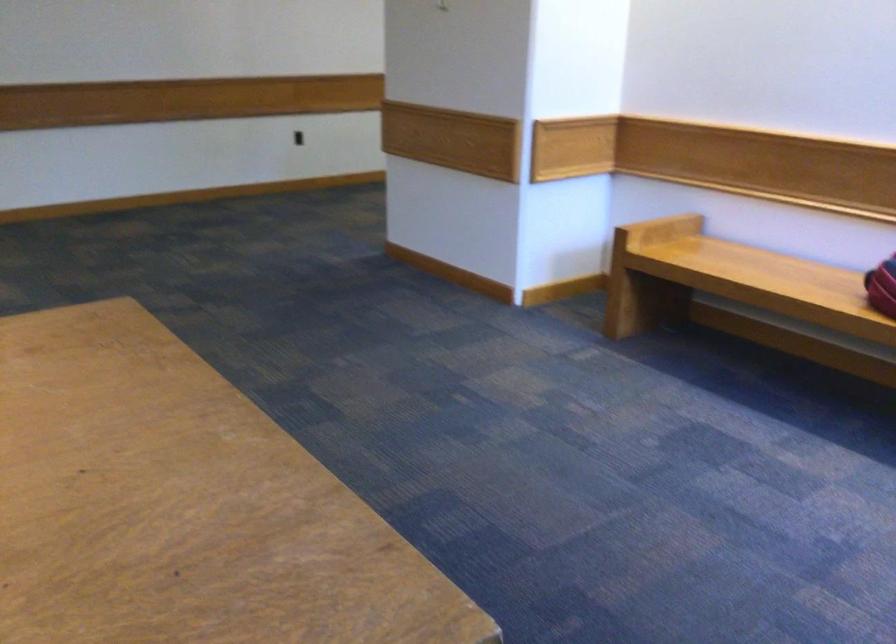
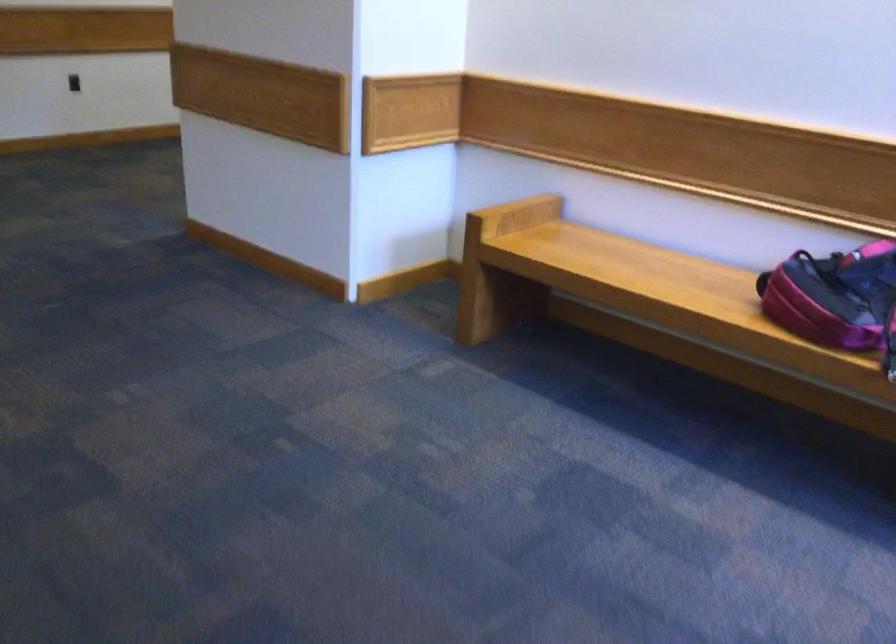
Question: Which direction would the cameraman need to move to produce the second image? Reply with the corresponding letter.

Choices:
 (A) Left
 (B) Right
 (C) Forward
 (D) Backward

Answer: (C)